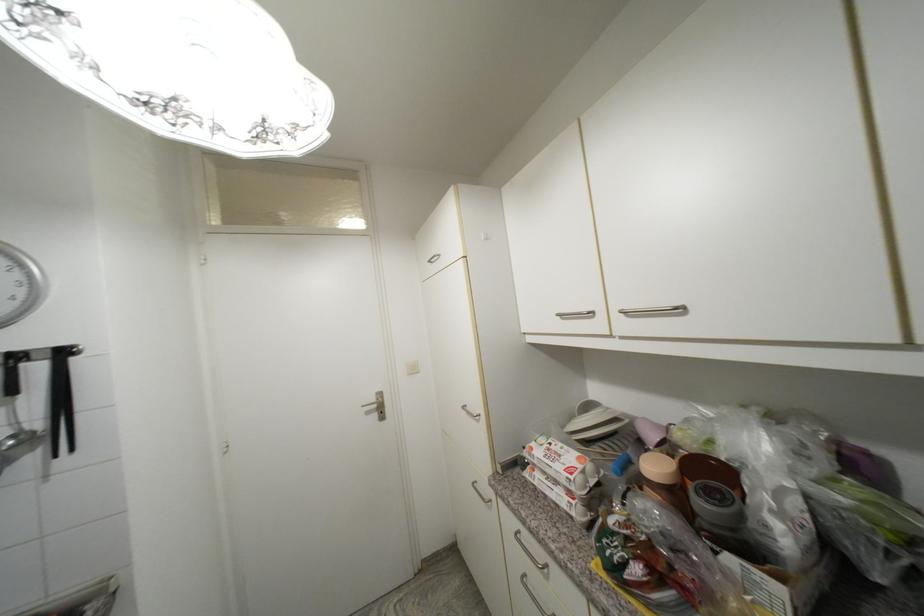
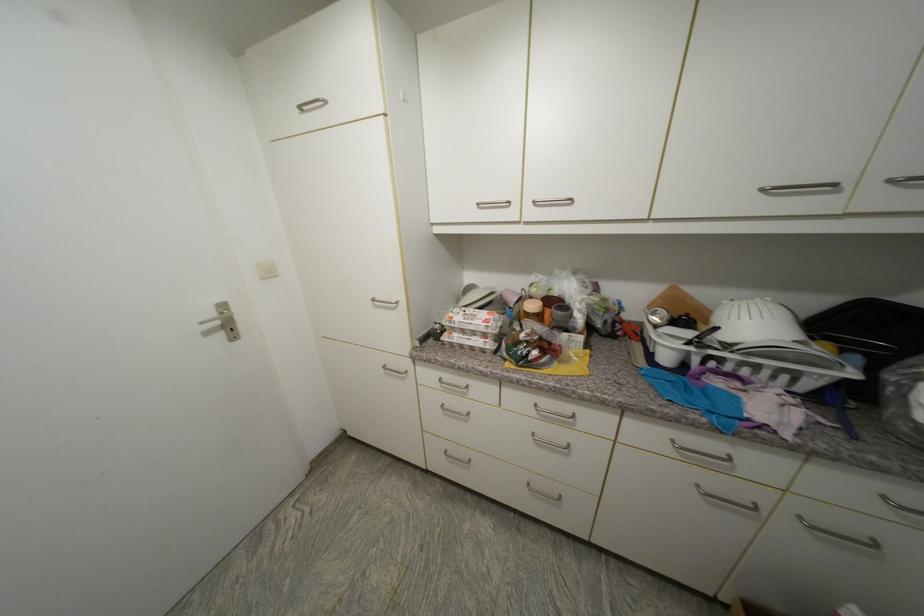
In the second image, find the point that corresponds to pixel 419 371 in the first image.

(274, 275)